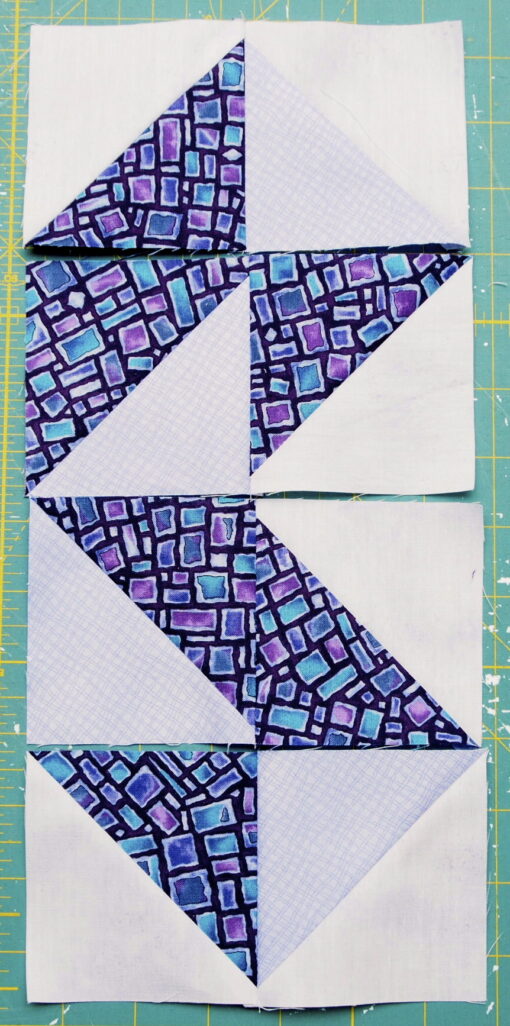
You are a GUI agent. You are given a task and a screenshot of the screen. Output one action in this format:
    pyautogui.click(x=<x>, y=<y>)
    Task: Click on the light patterned paper
    This screenshot has height=1026, width=510.
    Given the screenshot: What is the action you would take?
    pyautogui.click(x=323, y=819), pyautogui.click(x=96, y=688), pyautogui.click(x=180, y=417), pyautogui.click(x=323, y=209)